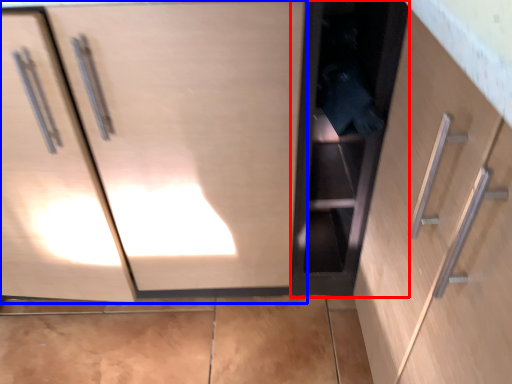
Question: Among these objects, which one is nearest to the camera, cabinetry (highlighted by a red box) or cabinetry (highlighted by a blue box)?

Choices:
 (A) cabinetry
 (B) cabinetry

Answer: (B)